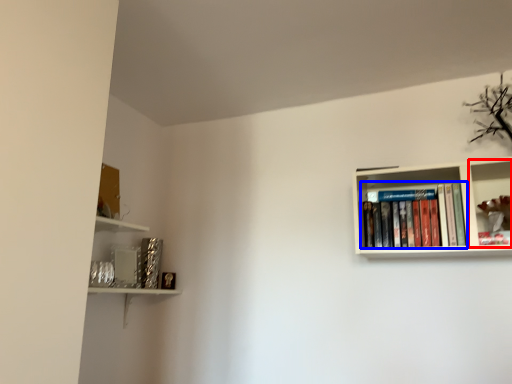
Question: Among these objects, which one is nearest to the camera, shelf (highlighted by a red box) or book (highlighted by a blue box)?

Choices:
 (A) shelf
 (B) book

Answer: (A)